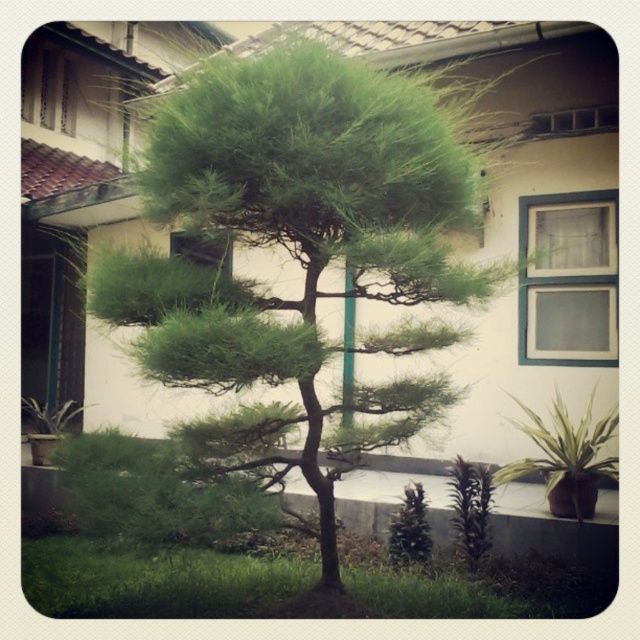
Question: From the image, what is the correct spatial relationship of green leafy tree at center in relation to green matte pine at lower center?

Choices:
 (A) above
 (B) below

Answer: (A)

Question: Which object is closer to the camera taking this photo?

Choices:
 (A) green leafy tree at center
 (B) green matte pine at center
 (C) green matte pine at lower center
 (D) green leafy plant at lower right

Answer: (A)

Question: Does green leafy plant at lower right appear on the left side of green matte pine at center?

Choices:
 (A) yes
 (B) no

Answer: (B)

Question: Which of the following is the farthest from the observer?

Choices:
 (A) (403, 564)
 (B) (294, 330)
 (C) (566, 417)
 (D) (483, 545)

Answer: (C)

Question: Among these objects, which one is nearest to the camera?

Choices:
 (A) green matte pine at lower center
 (B) green leafy plant at lower right

Answer: (A)

Question: Is green leafy plant at lower right positioned before green matte pine at center?

Choices:
 (A) yes
 (B) no

Answer: (B)